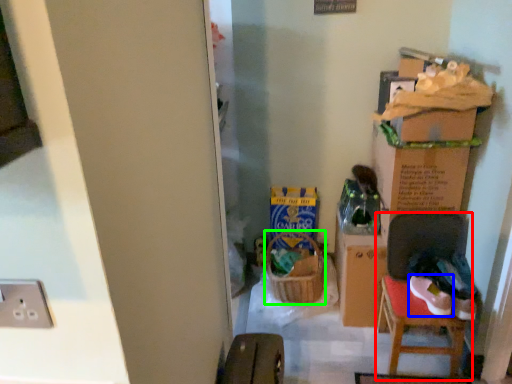
Question: Which object is the farthest from chair (highlighted by a red box)? Choose among these: footwear (highlighted by a blue box) or laundry basket (highlighted by a green box).

Choices:
 (A) footwear
 (B) laundry basket

Answer: (B)